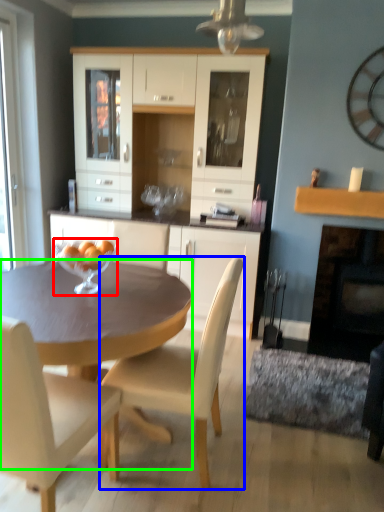
Question: Based on their relative distances, which object is farther from wine glass (highlighted by a red box)? Choose from chair (highlighted by a blue box) and desk (highlighted by a green box).

Choices:
 (A) chair
 (B) desk

Answer: (A)